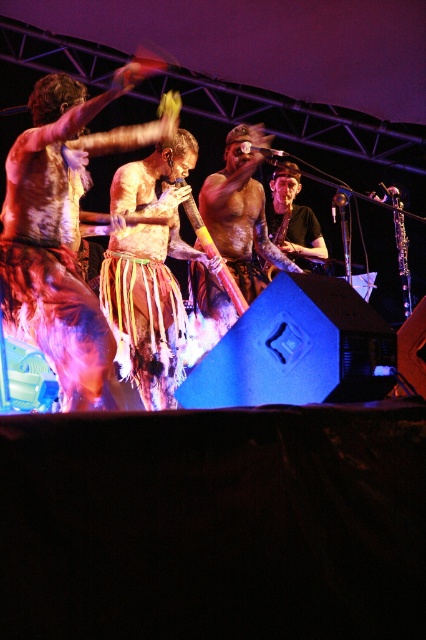
You are a photographer at the front row of this performance. You want to take a photo that focuses on the shiny silver guitar at center and the multicolored fringed skirt at center. Which object should you adjust your camera angle to focus on first if you want to capture both in the same frame?

The multicolored fringed skirt at center is located below the shiny silver guitar at center, so you should first focus on the shiny silver guitar at center to ensure both are in frame.

You are a photographer at the live performance scene. You want to capture a photo of the central figure playing the instrument. To ensure the central figure is in focus, you need to adjust your camera so that the point at position (112,397) is closer to the camera than the point at (317,225). Is this possible given the positions of these points?

Yes, because point (112,397) is in front of point (317,225), meaning it is closer to the camera. Adjusting the focus to prioritize the central figure at (112,397) will ensure it is in focus while the background point remains appropriately blurred.

You are a photographer at the live performance scene. You want to capture a closeup of the multicolored fringed skirt at center. The camera you are using has a 50mm lens. Given that the point corresponding to the multicolored fringed skirt at center is located at coordinates (149,273), can you determine if the skirt will be in the center of the frame?

The point corresponding to the multicolored fringed skirt at center is located at coordinates (149,273). Since the coordinates are given as 0.427 and 0.352, which are close to but not exactly at the center point of 0.5, the skirt will be slightly off to the left and lower than the exact center of the frame.